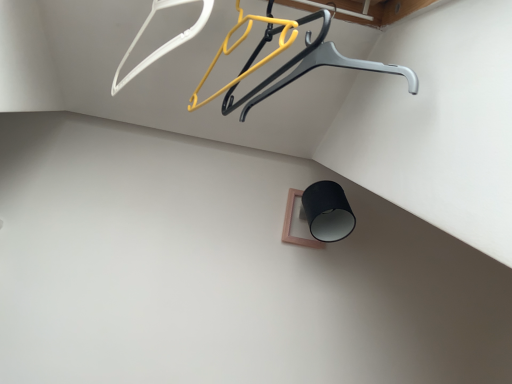
Question: Considering the relative positions of metallic gray hanger at upper center and white plastic hanger at upper left, which appears as the first hanger when viewed from the left, in the image provided, is metallic gray hanger at upper center to the left or to the right of white plastic hanger at upper left, which appears as the first hanger when viewed from the left,?

Choices:
 (A) left
 (B) right

Answer: (B)

Question: From a real-world perspective, is metallic gray hanger at upper center positioned above or below white plastic hanger at upper left, the second hanger from the right?

Choices:
 (A) above
 (B) below

Answer: (B)

Question: Considering the real-world distances, which object is closest to the metallic gray hanger at upper center?

Choices:
 (A) yellow plastic hanger at upper center, the 1th hanger when ordered from right to left
 (B) white plastic hanger at upper left, the second hanger from the right

Answer: (A)

Question: Considering the real-world distances, which object is farthest from the white plastic hanger at upper left, the second hanger from the right?

Choices:
 (A) metallic gray hanger at upper center
 (B) yellow plastic hanger at upper center, arranged as the second hanger when viewed from the left

Answer: (A)